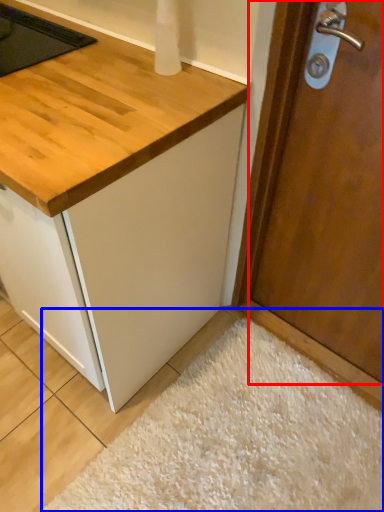
Question: Which of the following is the farthest to the observer, door (highlighted by a red box) or plain (highlighted by a blue box)?

Choices:
 (A) door
 (B) plain

Answer: (B)